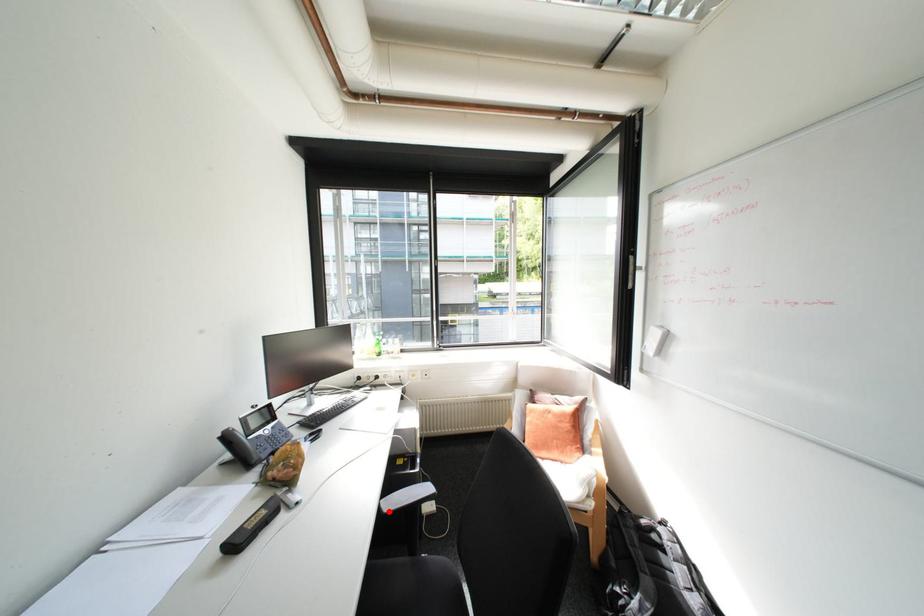
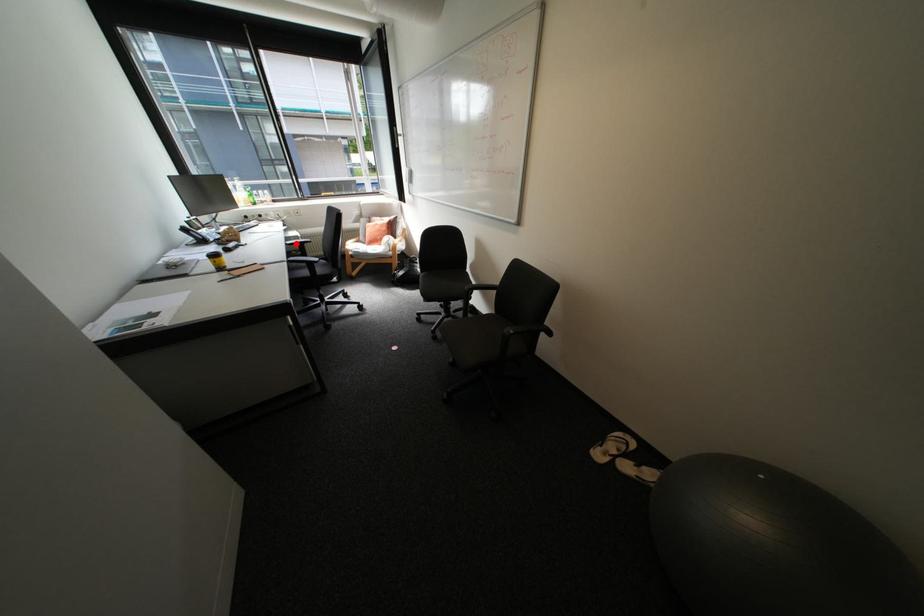
I am providing you with two images of the same scene from different viewpoints. A red point is marked on the first image and another point is marked on the second image. Does the point marked in image1 correspond to the same location as the one in image2?

Yes